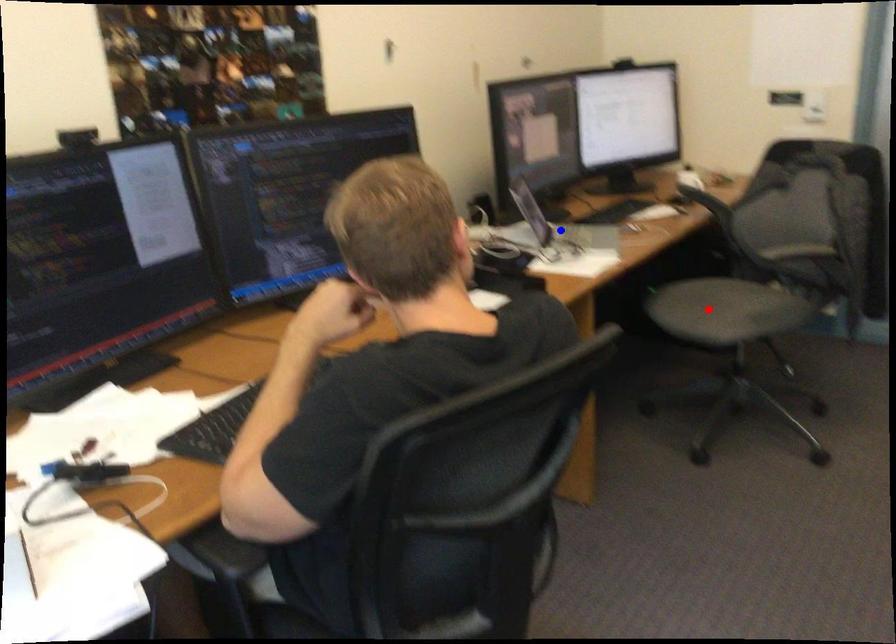
Question: In the image, two points are highlighted. Which point is nearer to the camera? Reply with the corresponding letter.

Choices:
 (A) blue point
 (B) red point

Answer: (A)